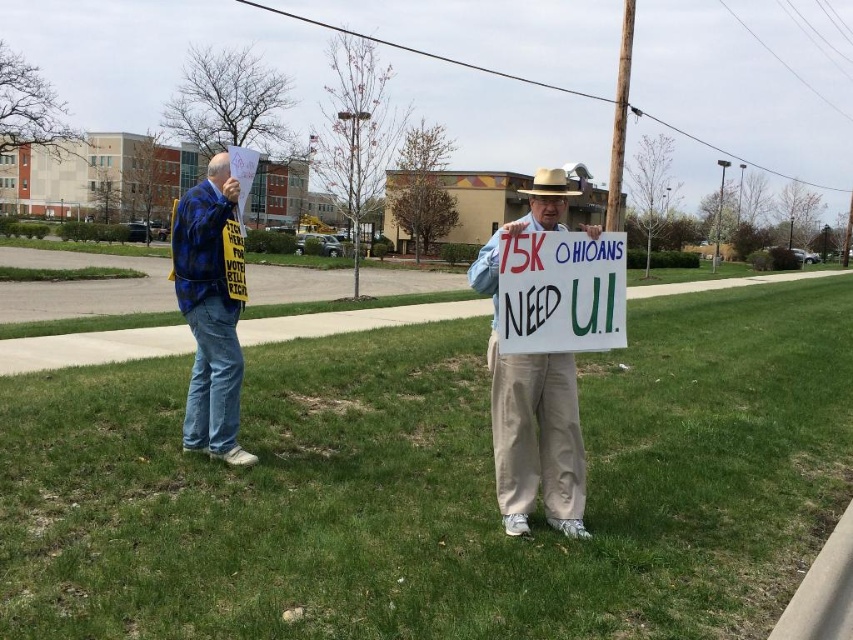
Question: Which object is positioned farthest from the white paper sign at center?

Choices:
 (A) brown felt cowboy hat at center
 (B) blue denim jeans at left
 (C) white cardboard sign at center

Answer: (A)

Question: Among these objects, which one is farthest from the camera?

Choices:
 (A) white paper sign at center
 (B) white cardboard sign at center

Answer: (B)

Question: Does blue denim jeans at left appear on the right side of white cardboard sign at center?

Choices:
 (A) yes
 (B) no

Answer: (B)

Question: Which object is closer to the camera taking this photo?

Choices:
 (A) blue denim jeans at left
 (B) white cardboard sign at center
 (C) white paper sign at center
 (D) brown felt cowboy hat at center

Answer: (C)

Question: Can you confirm if blue denim jeans at left is positioned to the right of white cardboard sign at center?

Choices:
 (A) no
 (B) yes

Answer: (A)

Question: Is white cardboard sign at center below brown felt cowboy hat at center?

Choices:
 (A) yes
 (B) no

Answer: (A)